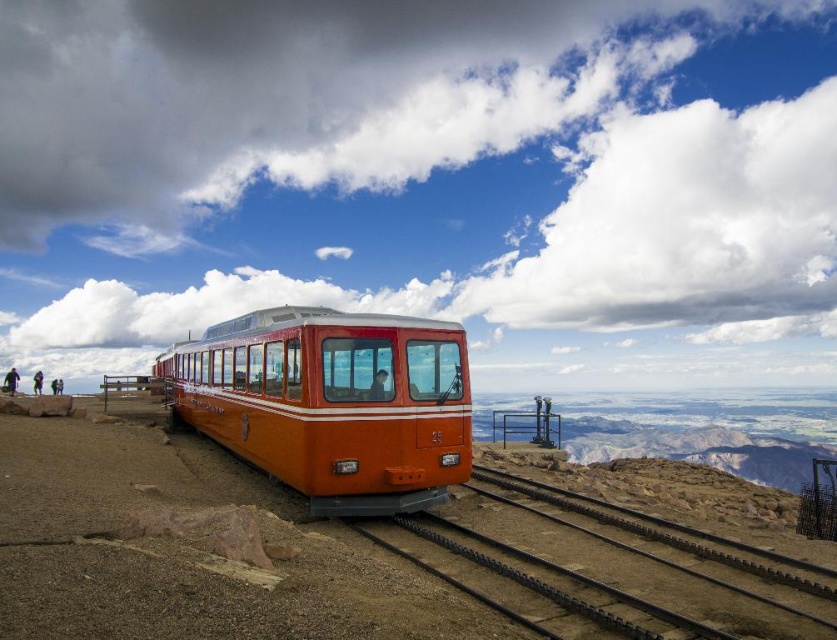
Which is more to the right, orange matte train at center or black metal track at center?

black metal track at center

Is point (250, 321) closer to camera compared to point (630, 557)?

No, it is behind (630, 557).

The width and height of the screenshot is (837, 640). Describe the element at coordinates (332, 403) in the screenshot. I see `orange matte train at center` at that location.

Find the location of a particular element. orange matte train at center is located at coordinates (332, 403).